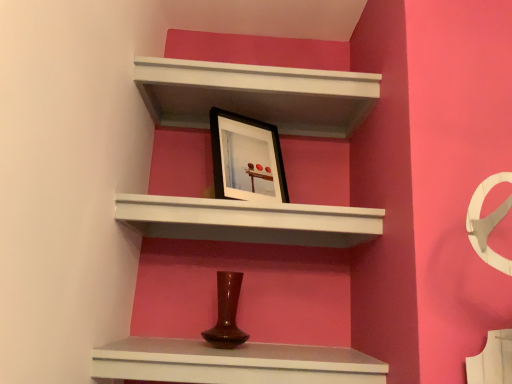
Find the location of `black matte picture frame at upper center`. black matte picture frame at upper center is located at coordinates (246, 158).

How much space does white matte shelf at upper center, the 3th shelf in the bottom-to-top sequence, occupy horizontally?

white matte shelf at upper center, the 3th shelf in the bottom-to-top sequence, is 13.29 inches wide.

What do you see at coordinates (248, 221) in the screenshot?
I see `white matte shelf at upper center, placed as the 2th shelf when sorted from bottom to top` at bounding box center [248, 221].

You are a GUI agent. You are given a task and a screenshot of the screen. Output one action in this format:
    pyautogui.click(x=<x>, y=<y>)
    Task: Click on the black matte picture frame at upper center
    
    Given the screenshot: What is the action you would take?
    pyautogui.click(x=246, y=158)

Is point (345, 209) in front of point (353, 128)?

Yes, it is in front of point (353, 128).

Is white matte shelf at upper center, placed as the 2th shelf when sorted from bottom to top, facing away from white matte shelf at upper center, positioned as the 1th shelf in top-to-bottom order?

No, white matte shelf at upper center, placed as the 2th shelf when sorted from bottom to top, is not facing the opposite direction of white matte shelf at upper center, positioned as the 1th shelf in top-to-bottom order.

Is white matte shelf at upper center, placed as the 2th shelf when sorted from bottom to top, inside or outside of white matte shelf at upper center, the 3th shelf in the bottom-to-top sequence?

white matte shelf at upper center, placed as the 2th shelf when sorted from bottom to top, is outside white matte shelf at upper center, the 3th shelf in the bottom-to-top sequence.

Who is smaller, black matte picture frame at upper center or matte brown vase at center, arranged as the 1th shelf when ordered from the bottom?

black matte picture frame at upper center is smaller.

Considering the sizes of objects black matte picture frame at upper center and matte brown vase at center, which appears as the third shelf when viewed from the top, in the image provided, who is taller, black matte picture frame at upper center or matte brown vase at center, which appears as the third shelf when viewed from the top,?

black matte picture frame at upper center is taller.

From a real-world perspective, which is physically below, black matte picture frame at upper center or matte brown vase at center, which appears as the third shelf when viewed from the top?

matte brown vase at center, which appears as the third shelf when viewed from the top, from a real-world perspective.

Would you say matte brown vase at center, which appears as the third shelf when viewed from the top, is part of black matte picture frame at upper center's contents?

That's incorrect, matte brown vase at center, which appears as the third shelf when viewed from the top, is not inside black matte picture frame at upper center.

Considering the positions of objects matte brown vase at center, arranged as the 1th shelf when ordered from the bottom, and white matte shelf at upper center, placed as the 2th shelf when sorted from bottom to top, in the image provided, who is more to the right, matte brown vase at center, arranged as the 1th shelf when ordered from the bottom, or white matte shelf at upper center, placed as the 2th shelf when sorted from bottom to top,?

white matte shelf at upper center, placed as the 2th shelf when sorted from bottom to top.

Is matte brown vase at center, which appears as the third shelf when viewed from the top, oriented towards white matte shelf at upper center, arranged as the 2th shelf when viewed from the top?

No, matte brown vase at center, which appears as the third shelf when viewed from the top, is not facing towards white matte shelf at upper center, arranged as the 2th shelf when viewed from the top.

Is matte brown vase at center, which appears as the third shelf when viewed from the top, directly adjacent to white matte shelf at upper center, arranged as the 2th shelf when viewed from the top?

matte brown vase at center, which appears as the third shelf when viewed from the top, and white matte shelf at upper center, arranged as the 2th shelf when viewed from the top, are not in contact.

Can you tell me how much matte brown vase at center, arranged as the 1th shelf when ordered from the bottom, and white matte shelf at upper center, placed as the 2th shelf when sorted from bottom to top, differ in facing direction?

There is a 0.000662-degree angle between the facing directions of matte brown vase at center, arranged as the 1th shelf when ordered from the bottom, and white matte shelf at upper center, placed as the 2th shelf when sorted from bottom to top.

Identify the location of picture frame behind the white matte shelf at upper center, placed as the 2th shelf when sorted from bottom to top. The width and height of the screenshot is (512, 384). (246, 158).

Are white matte shelf at upper center, arranged as the 2th shelf when viewed from the top, and black matte picture frame at upper center located far from each other?

They are positioned close to each other.

Looking at the image, does white matte shelf at upper center, placed as the 2th shelf when sorted from bottom to top, seem bigger or smaller compared to black matte picture frame at upper center?

white matte shelf at upper center, placed as the 2th shelf when sorted from bottom to top, is bigger than black matte picture frame at upper center.

Is white matte shelf at upper center, placed as the 2th shelf when sorted from bottom to top, positioned in front of black matte picture frame at upper center?

Yes.

Is white matte shelf at upper center, arranged as the 2th shelf when viewed from the top, located outside matte brown vase at center, arranged as the 1th shelf when ordered from the bottom?

Yes, white matte shelf at upper center, arranged as the 2th shelf when viewed from the top, is not within matte brown vase at center, arranged as the 1th shelf when ordered from the bottom.

Considering the sizes of objects white matte shelf at upper center, placed as the 2th shelf when sorted from bottom to top, and matte brown vase at center, arranged as the 1th shelf when ordered from the bottom, in the image provided, who is thinner, white matte shelf at upper center, placed as the 2th shelf when sorted from bottom to top, or matte brown vase at center, arranged as the 1th shelf when ordered from the bottom,?

matte brown vase at center, arranged as the 1th shelf when ordered from the bottom, is thinner.

Which object is positioned more to the left, white matte shelf at upper center, arranged as the 2th shelf when viewed from the top, or matte brown vase at center, arranged as the 1th shelf when ordered from the bottom?

matte brown vase at center, arranged as the 1th shelf when ordered from the bottom.

Does point (226, 209) come behind point (355, 366)?

Yes, point (226, 209) is behind point (355, 366).

How far apart are black matte picture frame at upper center and white matte shelf at upper center, positioned as the 1th shelf in top-to-bottom order?

They are 7.01 inches apart.

Considering the relative positions of black matte picture frame at upper center and white matte shelf at upper center, positioned as the 1th shelf in top-to-bottom order, in the image provided, is black matte picture frame at upper center to the left of white matte shelf at upper center, positioned as the 1th shelf in top-to-bottom order, from the viewer's perspective?

Correct, you'll find black matte picture frame at upper center to the left of white matte shelf at upper center, positioned as the 1th shelf in top-to-bottom order.

Is black matte picture frame at upper center far away from white matte shelf at upper center, the 3th shelf in the bottom-to-top sequence?

They are positioned close to each other.

Is black matte picture frame at upper center facing away from white matte shelf at upper center, positioned as the 1th shelf in top-to-bottom order?

No, black matte picture frame at upper center is not facing the opposite direction of white matte shelf at upper center, positioned as the 1th shelf in top-to-bottom order.

In order to click on shelf above the white matte shelf at upper center, placed as the 2th shelf when sorted from bottom to top (from a real-world perspective) in this screenshot , I will do `click(256, 95)`.

Consider the image. Considering the sizes of objects white matte shelf at upper center, the 3th shelf in the bottom-to-top sequence, and white matte shelf at upper center, arranged as the 2th shelf when viewed from the top, in the image provided, who is shorter, white matte shelf at upper center, the 3th shelf in the bottom-to-top sequence, or white matte shelf at upper center, arranged as the 2th shelf when viewed from the top,?

white matte shelf at upper center, the 3th shelf in the bottom-to-top sequence, is shorter.

Considering the relative sizes of white matte shelf at upper center, positioned as the 1th shelf in top-to-bottom order, and white matte shelf at upper center, arranged as the 2th shelf when viewed from the top, in the image provided, is white matte shelf at upper center, positioned as the 1th shelf in top-to-bottom order, bigger than white matte shelf at upper center, arranged as the 2th shelf when viewed from the top,?

Incorrect, white matte shelf at upper center, positioned as the 1th shelf in top-to-bottom order, is not larger than white matte shelf at upper center, arranged as the 2th shelf when viewed from the top.

Is white matte shelf at upper center, the 3th shelf in the bottom-to-top sequence, facing towards white matte shelf at upper center, arranged as the 2th shelf when viewed from the top?

No, white matte shelf at upper center, the 3th shelf in the bottom-to-top sequence, is not aimed at white matte shelf at upper center, arranged as the 2th shelf when viewed from the top.

I want to click on the 1st shelf below when counting from the white matte shelf at upper center, positioned as the 1th shelf in top-to-bottom order (from the image's perspective), so click(248, 221).

This screenshot has width=512, height=384. I want to click on the 2nd shelf positioned below the black matte picture frame at upper center (from a real-world perspective), so click(x=233, y=363).

From the picture: Which object lies nearer to the anchor point white matte shelf at upper center, placed as the 2th shelf when sorted from bottom to top, black matte picture frame at upper center or matte brown vase at center, which appears as the third shelf when viewed from the top?

black matte picture frame at upper center is closer to white matte shelf at upper center, placed as the 2th shelf when sorted from bottom to top.

When comparing their distances from black matte picture frame at upper center, does white matte shelf at upper center, the 3th shelf in the bottom-to-top sequence, or white matte shelf at upper center, placed as the 2th shelf when sorted from bottom to top, seem closer?

white matte shelf at upper center, the 3th shelf in the bottom-to-top sequence, is closer to black matte picture frame at upper center.

Estimate the real-world distances between objects in this image. Which object is closer to matte brown vase at center, which appears as the third shelf when viewed from the top, white matte shelf at upper center, placed as the 2th shelf when sorted from bottom to top, or black matte picture frame at upper center?

white matte shelf at upper center, placed as the 2th shelf when sorted from bottom to top, is closer to matte brown vase at center, which appears as the third shelf when viewed from the top.

Looking at the image, which one is located further to white matte shelf at upper center, arranged as the 2th shelf when viewed from the top, white matte shelf at upper center, positioned as the 1th shelf in top-to-bottom order, or black matte picture frame at upper center?

Based on the image, white matte shelf at upper center, positioned as the 1th shelf in top-to-bottom order, appears to be further to white matte shelf at upper center, arranged as the 2th shelf when viewed from the top.

Looking at the image, which one is located further to white matte shelf at upper center, arranged as the 2th shelf when viewed from the top, matte brown vase at center, which appears as the third shelf when viewed from the top, or black matte picture frame at upper center?

Based on the image, matte brown vase at center, which appears as the third shelf when viewed from the top, appears to be further to white matte shelf at upper center, arranged as the 2th shelf when viewed from the top.

Estimate the real-world distances between objects in this image. Which object is closer to black matte picture frame at upper center, white matte shelf at upper center, positioned as the 1th shelf in top-to-bottom order, or matte brown vase at center, which appears as the third shelf when viewed from the top?

white matte shelf at upper center, positioned as the 1th shelf in top-to-bottom order, is closer to black matte picture frame at upper center.

Estimate the real-world distances between objects in this image. Which object is further from white matte shelf at upper center, arranged as the 2th shelf when viewed from the top, white matte shelf at upper center, positioned as the 1th shelf in top-to-bottom order, or matte brown vase at center, which appears as the third shelf when viewed from the top?

white matte shelf at upper center, positioned as the 1th shelf in top-to-bottom order.

When comparing their distances from white matte shelf at upper center, the 3th shelf in the bottom-to-top sequence, does white matte shelf at upper center, placed as the 2th shelf when sorted from bottom to top, or matte brown vase at center, arranged as the 1th shelf when ordered from the bottom, seem closer?

Based on the image, white matte shelf at upper center, placed as the 2th shelf when sorted from bottom to top, appears to be nearer to white matte shelf at upper center, the 3th shelf in the bottom-to-top sequence.

Where is `picture frame between white matte shelf at upper center, the 3th shelf in the bottom-to-top sequence, and white matte shelf at upper center, placed as the 2th shelf when sorted from bottom to top, from top to bottom`? Image resolution: width=512 pixels, height=384 pixels. picture frame between white matte shelf at upper center, the 3th shelf in the bottom-to-top sequence, and white matte shelf at upper center, placed as the 2th shelf when sorted from bottom to top, from top to bottom is located at coordinates (246, 158).

The height and width of the screenshot is (384, 512). Identify the location of shelf between black matte picture frame at upper center and matte brown vase at center, which appears as the third shelf when viewed from the top, from top to bottom. (248, 221).

In order to click on shelf between white matte shelf at upper center, positioned as the 1th shelf in top-to-bottom order, and matte brown vase at center, arranged as the 1th shelf when ordered from the bottom, in the vertical direction in this screenshot , I will do `click(248, 221)`.

Where is `picture frame between white matte shelf at upper center, the 3th shelf in the bottom-to-top sequence, and matte brown vase at center, which appears as the third shelf when viewed from the top, vertically`? picture frame between white matte shelf at upper center, the 3th shelf in the bottom-to-top sequence, and matte brown vase at center, which appears as the third shelf when viewed from the top, vertically is located at coordinates (246, 158).